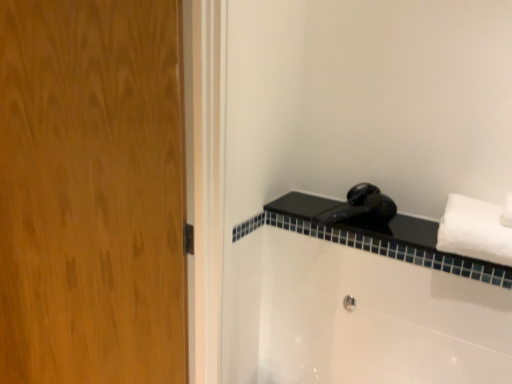
What do you see at coordinates (91, 193) in the screenshot? The width and height of the screenshot is (512, 384). I see `wooden door at left` at bounding box center [91, 193].

Locate an element on the screen. This screenshot has height=384, width=512. wooden door at left is located at coordinates (91, 193).

Find the location of `white fluffy towel at right`. white fluffy towel at right is located at coordinates (477, 229).

Which of these two, wooden door at left or metallic silver showerhead at lower center, is bigger?

Bigger between the two is wooden door at left.

Identify the location of shower below the wooden door at left (from the image's perspective). (349, 303).

From a real-world perspective, which object stands above the other?

From a 3D spatial view, wooden door at left is above.

Considering the sizes of objects wooden door at left and metallic silver showerhead at lower center in the image provided, who is wider, wooden door at left or metallic silver showerhead at lower center?

With larger width is wooden door at left.

Is black glossy hairdryer at upper right beside white fluffy towel at right?

No, black glossy hairdryer at upper right is not making contact with white fluffy towel at right.

Does black glossy hairdryer at upper right have a smaller size compared to white fluffy towel at right?

Correct, black glossy hairdryer at upper right occupies less space than white fluffy towel at right.

Is black glossy hairdryer at upper right oriented towards white fluffy towel at right?

No, black glossy hairdryer at upper right is not oriented towards white fluffy towel at right.

Is black glossy hairdryer at upper right inside the boundaries of wooden door at left, or outside?

black glossy hairdryer at upper right is located beyond the bounds of wooden door at left.

From a real-world perspective, relative to wooden door at left, is black glossy hairdryer at upper right vertically above or below?

black glossy hairdryer at upper right is situated lower than wooden door at left in the real world.

Considering the positions of objects black glossy hairdryer at upper right and wooden door at left in the image provided, who is behind, black glossy hairdryer at upper right or wooden door at left?

black glossy hairdryer at upper right is behind.

How different are the orientations of black matte faucet at upper right and white fluffy towel at right in degrees?

0.258 degrees.

Visually, is black matte faucet at upper right positioned to the left or to the right of white fluffy towel at right?

From the image, it's evident that black matte faucet at upper right is to the left of white fluffy towel at right.

Which is correct: black matte faucet at upper right is inside white fluffy towel at right, or outside of it?

black matte faucet at upper right is not enclosed by white fluffy towel at right.

From a real-world perspective, is black matte faucet at upper right positioned under white fluffy towel at right based on gravity?

Correct, in the physical world, black matte faucet at upper right is lower than white fluffy towel at right.

Is metallic silver showerhead at lower center facing away from black glossy hairdryer at upper right?

No, metallic silver showerhead at lower center's orientation is not away from black glossy hairdryer at upper right.

Can you tell me how much metallic silver showerhead at lower center and black glossy hairdryer at upper right differ in facing direction?

The angular difference between metallic silver showerhead at lower center and black glossy hairdryer at upper right is 0.0592 degrees.

From a real-world perspective, is metallic silver showerhead at lower center positioned over black glossy hairdryer at upper right based on gravity?

No, from a real-world perspective, metallic silver showerhead at lower center is not over black glossy hairdryer at upper right

Based on their sizes in the image, would you say metallic silver showerhead at lower center is bigger or smaller than black glossy hairdryer at upper right?

metallic silver showerhead at lower center is smaller than black glossy hairdryer at upper right.

Is metallic silver showerhead at lower center not near white fluffy towel at right?

They are positioned close to each other.

From the image's perspective, is metallic silver showerhead at lower center above or below white fluffy towel at right?

Clearly, from the image's perspective, metallic silver showerhead at lower center is below white fluffy towel at right.

Between point (350, 305) and point (464, 204), which one is positioned in front?

The point (464, 204) is more forward.

Locate an element on the screen. The width and height of the screenshot is (512, 384). towel above the metallic silver showerhead at lower center (from the image's perspective) is located at coordinates (477, 229).

Considering the relative sizes of wooden door at left and white fluffy towel at right in the image provided, is wooden door at left bigger than white fluffy towel at right?

Yes.

Can white fluffy towel at right be found inside wooden door at left?

That's incorrect, white fluffy towel at right is not inside wooden door at left.

From the image's perspective, between wooden door at left and white fluffy towel at right, which one is located above?

white fluffy towel at right, from the image's perspective.

Is point (115, 307) closer or farther from the camera than point (484, 245)?

Point (115, 307) is farther from the camera than point (484, 245).

In order to click on shower below the wooden door at left (from a real-world perspective) in this screenshot , I will do `click(349, 303)`.

Identify the location of balustrade behind the white fluffy towel at right. (379, 237).

Based on their spatial positions, is white fluffy towel at right or black matte faucet at upper right closer to black glossy hairdryer at upper right?

black matte faucet at upper right lies closer to black glossy hairdryer at upper right than the other object.

Looking at the image, which one is located further to black glossy hairdryer at upper right, wooden door at left or metallic silver showerhead at lower center?

wooden door at left lies further to black glossy hairdryer at upper right than the other object.

From the image, which object appears to be farther from black glossy hairdryer at upper right, wooden door at left or white fluffy towel at right?

wooden door at left is positioned further to the anchor black glossy hairdryer at upper right.

Which object lies further to the anchor point black glossy hairdryer at upper right, black matte faucet at upper right or white fluffy towel at right?

Based on the image, white fluffy towel at right appears to be further to black glossy hairdryer at upper right.

Considering their positions, is wooden door at left positioned further to white fluffy towel at right than metallic silver showerhead at lower center?

Among the two, wooden door at left is located further to white fluffy towel at right.

Considering their positions, is metallic silver showerhead at lower center positioned closer to black matte faucet at upper right than wooden door at left?

metallic silver showerhead at lower center.

Which object lies further to the anchor point black glossy hairdryer at upper right, wooden door at left or black matte faucet at upper right?

Among the two, wooden door at left is located further to black glossy hairdryer at upper right.

From the image, which object appears to be nearer to metallic silver showerhead at lower center, black matte faucet at upper right or white fluffy towel at right?

black matte faucet at upper right lies closer to metallic silver showerhead at lower center than the other object.

Image resolution: width=512 pixels, height=384 pixels. Identify the location of faucet between wooden door at left and white fluffy towel at right from left to right. (362, 210).

Locate an element on the screen. This screenshot has height=384, width=512. faucet between white fluffy towel at right and metallic silver showerhead at lower center in the front-back direction is located at coordinates (362, 210).

You are a GUI agent. You are given a task and a screenshot of the screen. Output one action in this format:
    pyautogui.click(x=<x>, y=<y>)
    Task: Click on the balustrade positioned between wooden door at left and metallic silver showerhead at lower center from near to far
    
    Given the screenshot: What is the action you would take?
    pyautogui.click(x=379, y=237)

Find the location of a particular element. This screenshot has width=512, height=384. balustrade between black matte faucet at upper right and metallic silver showerhead at lower center in the up-down direction is located at coordinates (379, 237).